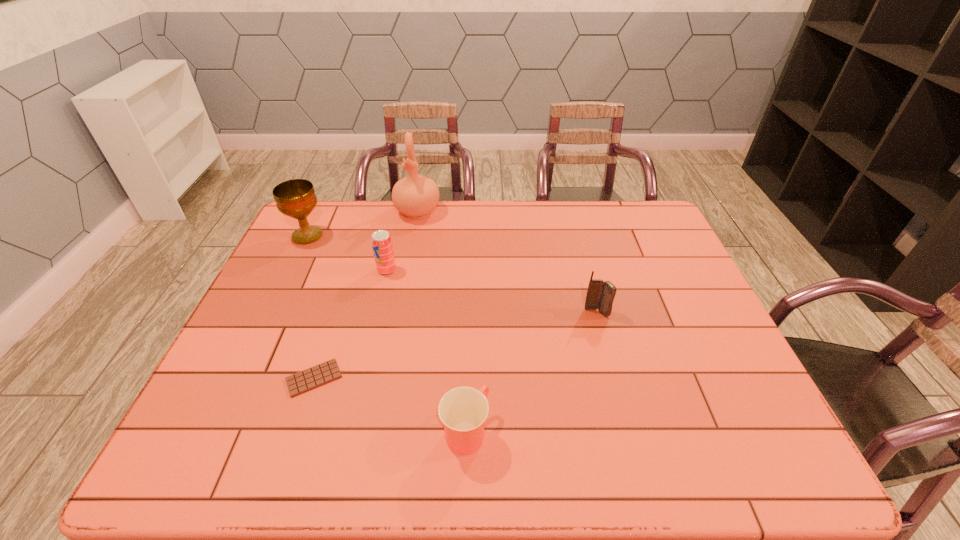
The image size is (960, 540). In order to click on vacant space that satisfies the following two spatial constraints: 1. on the front side of the cup; 2. on the right side of the chalice in this screenshot , I will do `click(213, 431)`.

Identify the location of vacant area in the image that satisfies the following two spatial constraints: 1. on the front side of the chalice; 2. on the left side of the candy bar. Image resolution: width=960 pixels, height=540 pixels. (238, 378).